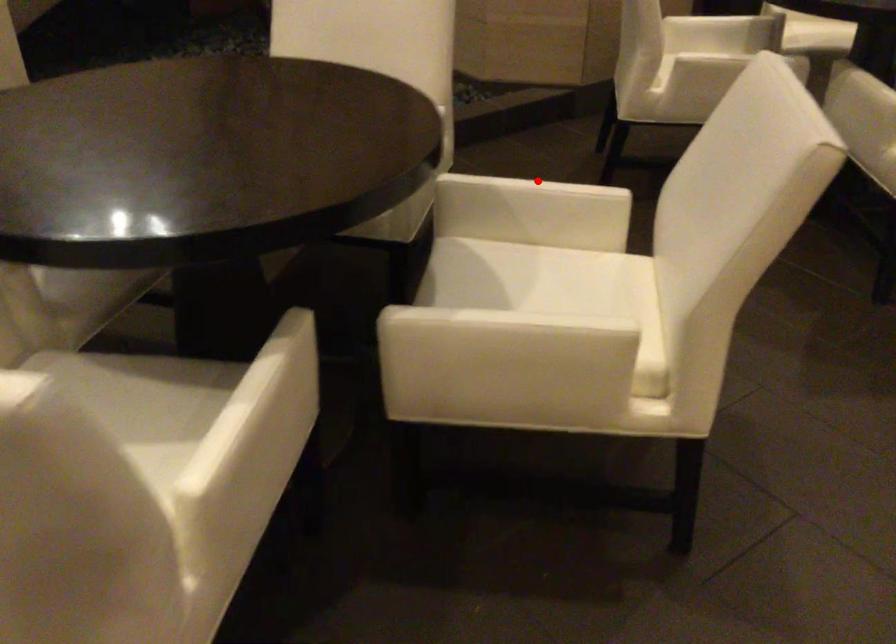
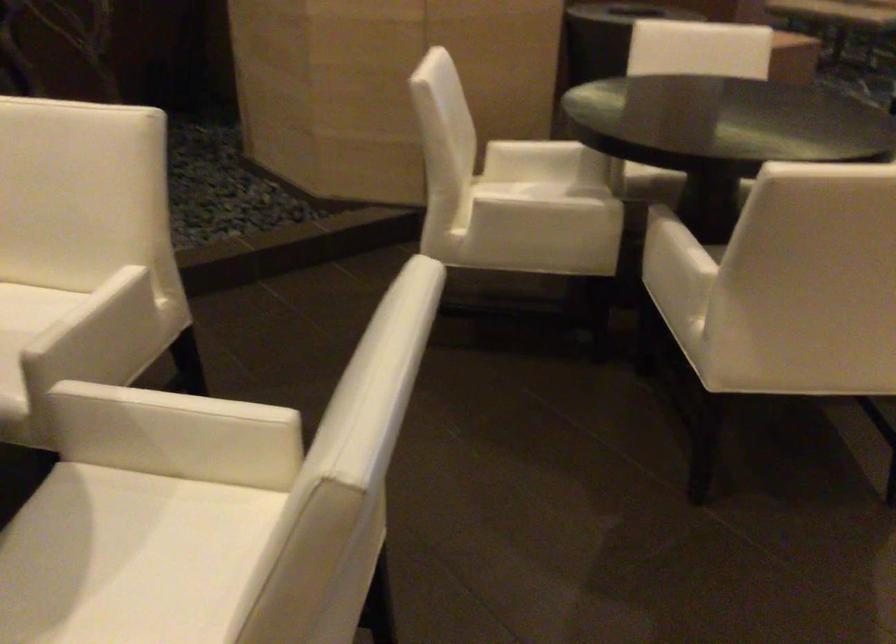
Question: I am providing you with two images of the same scene from different viewpoints. In image1, a red point is highlighted. Considering the same 3D point in image2, which of the following is correct?

Choices:
 (A) It is closer
 (B) It is farther

Answer: (A)